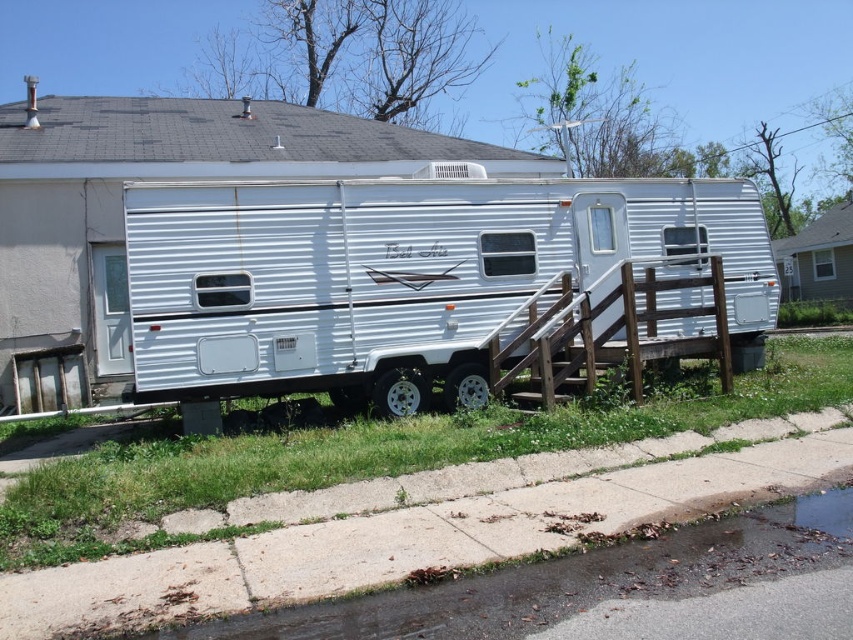
Does white metallic trailer at center lie in front of wooden rail at center?

Yes, it is in front of wooden rail at center.

Is point (235, 244) closer to viewer compared to point (584, 337)?

Yes, point (235, 244) is closer to viewer.

You are a GUI agent. You are given a task and a screenshot of the screen. Output one action in this format:
    pyautogui.click(x=<x>, y=<y>)
    Task: Click on the white metallic trailer at center
    
    Given the screenshot: What is the action you would take?
    pyautogui.click(x=402, y=275)